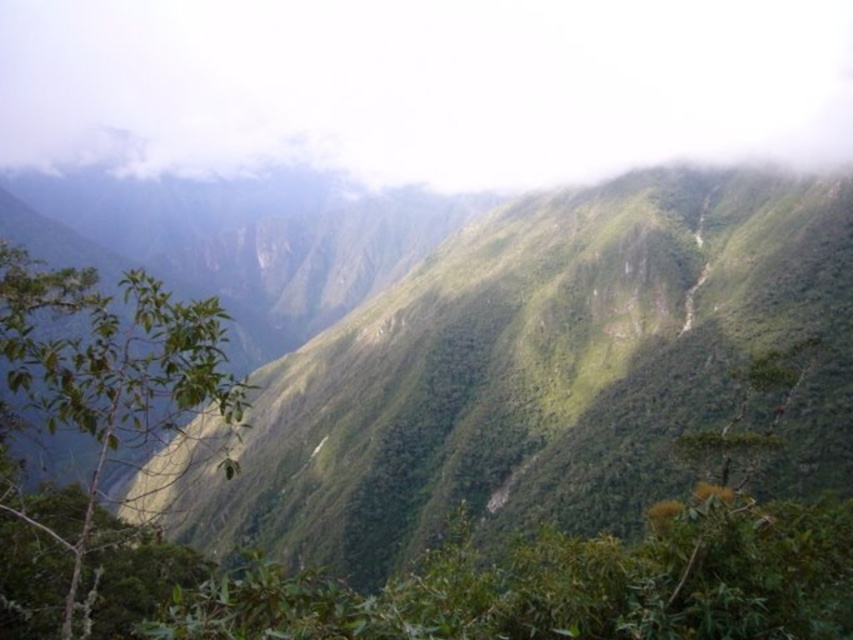
Question: Does white fluffy cloud at upper center appear under green leafy branch at lower left?

Choices:
 (A) yes
 (B) no

Answer: (B)

Question: Among these points, which one is farthest from the camera?

Choices:
 (A) (688, 124)
 (B) (138, 342)

Answer: (A)

Question: Does white fluffy cloud at upper center appear on the right side of green leafy branch at lower left?

Choices:
 (A) no
 (B) yes

Answer: (A)

Question: Is white fluffy cloud at upper center bigger than green leafy branch at lower left?

Choices:
 (A) yes
 (B) no

Answer: (A)

Question: Which point is closer to the camera?

Choices:
 (A) (405, 65)
 (B) (233, 403)

Answer: (B)

Question: Which point appears closest to the camera in this image?

Choices:
 (A) (x=706, y=77)
 (B) (x=120, y=312)

Answer: (B)